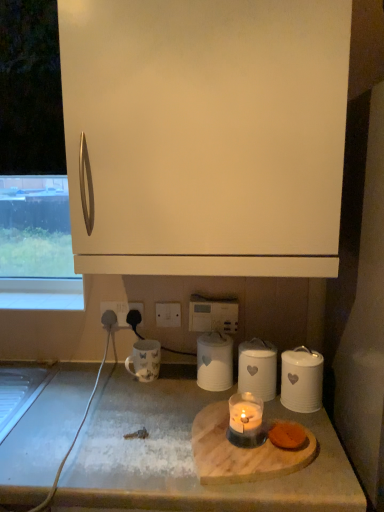
This screenshot has height=512, width=384. I want to click on vacant space underneath white matte cabinet at upper center (from a real-world perspective), so click(173, 400).